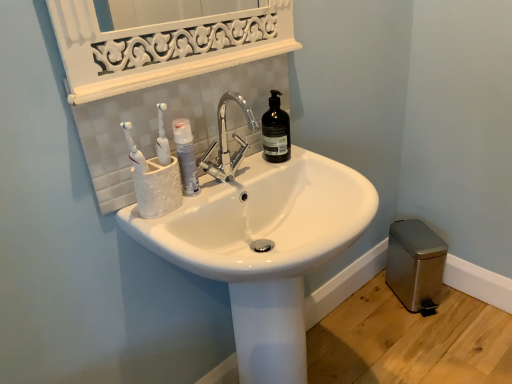
Question: Could you tell me if white glossy mouthwash at center is turned towards white glossy sink at center?

Choices:
 (A) no
 (B) yes

Answer: (A)

Question: From a real-world perspective, is white glossy mouthwash at center positioned over white glossy sink at center based on gravity?

Choices:
 (A) yes
 (B) no

Answer: (A)

Question: Can you confirm if white glossy mouthwash at center is wider than white glossy sink at center?

Choices:
 (A) no
 (B) yes

Answer: (A)

Question: Is white glossy mouthwash at center to the right of white glossy sink at center from the viewer's perspective?

Choices:
 (A) yes
 (B) no

Answer: (B)

Question: Is white glossy mouthwash at center thinner than white glossy sink at center?

Choices:
 (A) yes
 (B) no

Answer: (A)

Question: In terms of width, does metallic gray trash can at lower right look wider or thinner when compared to white glossy mouthwash at center?

Choices:
 (A) wide
 (B) thin

Answer: (A)

Question: Based on their sizes in the image, would you say metallic gray trash can at lower right is bigger or smaller than white glossy mouthwash at center?

Choices:
 (A) small
 (B) big

Answer: (B)

Question: Relative to white glossy mouthwash at center, is metallic gray trash can at lower right in front or behind?

Choices:
 (A) front
 (B) behind

Answer: (B)

Question: In terms of height, does metallic gray trash can at lower right look taller or shorter compared to white glossy mouthwash at center?

Choices:
 (A) tall
 (B) short

Answer: (A)

Question: Considering the positions of black matte bottle at upper center and white glossy sink at center in the image, is black matte bottle at upper center taller or shorter than white glossy sink at center?

Choices:
 (A) short
 (B) tall

Answer: (A)

Question: From a real-world perspective, relative to white glossy sink at center, is black matte bottle at upper center vertically above or below?

Choices:
 (A) above
 (B) below

Answer: (A)

Question: Would you say black matte bottle at upper center is inside or outside white glossy sink at center?

Choices:
 (A) inside
 (B) outside

Answer: (B)

Question: Considering the positions of point (275, 97) and point (265, 317), is point (275, 97) closer or farther from the camera than point (265, 317)?

Choices:
 (A) farther
 (B) closer

Answer: (A)

Question: From the image's perspective, relative to black matte bottle at upper center, is white glossy mouthwash at center above or below?

Choices:
 (A) below
 (B) above

Answer: (A)

Question: In the image, is white glossy mouthwash at center positioned in front of or behind black matte bottle at upper center?

Choices:
 (A) behind
 (B) front

Answer: (B)